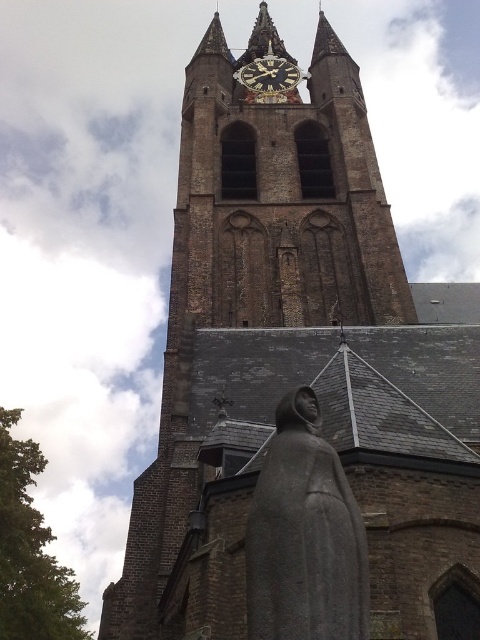
This screenshot has width=480, height=640. What do you see at coordinates (280, 196) in the screenshot?
I see `brown stone clock tower at center` at bounding box center [280, 196].

Is the position of brown stone clock tower at center less distant than that of gray stone statue at center?

No.

Which is in front, point (327, 122) or point (321, 500)?

Point (321, 500)

The width and height of the screenshot is (480, 640). I want to click on brown stone clock tower at center, so click(280, 196).

Which is above, brown stone clock tower at center or dark brown wooden clock at center?

dark brown wooden clock at center

Who is more forward, (276, 157) or (252, 90)?

Point (276, 157)

Which is behind, point (321, 44) or point (296, 65)?

Positioned behind is point (296, 65).

At what (x,y) coordinates should I click in order to perform the action: click on brown stone clock tower at center. Please return your answer as a coordinate pair (x, y). The image size is (480, 640). Looking at the image, I should click on (280, 196).

Does gray stone statue at center appear over dark brown wooden clock at center?

No.

Can you confirm if gray stone statue at center is positioned to the right of dark brown wooden clock at center?

Incorrect, gray stone statue at center is not on the right side of dark brown wooden clock at center.

Is point (266, 531) closer to camera compared to point (254, 81)?

Yes, point (266, 531) is in front of point (254, 81).

Find the location of a particular element. This screenshot has height=640, width=480. gray stone statue at center is located at coordinates (304, 536).